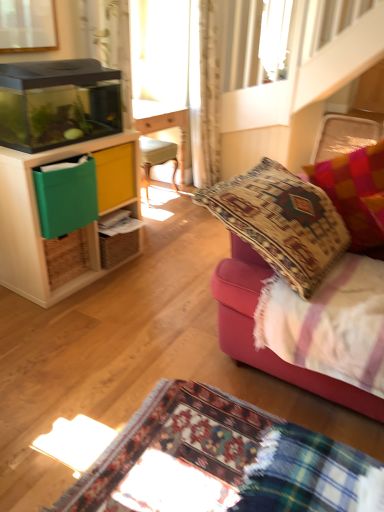
This screenshot has height=512, width=384. What are the coordinates of `free space to the right of matte wood cabinet at left` in the screenshot? It's located at (162, 282).